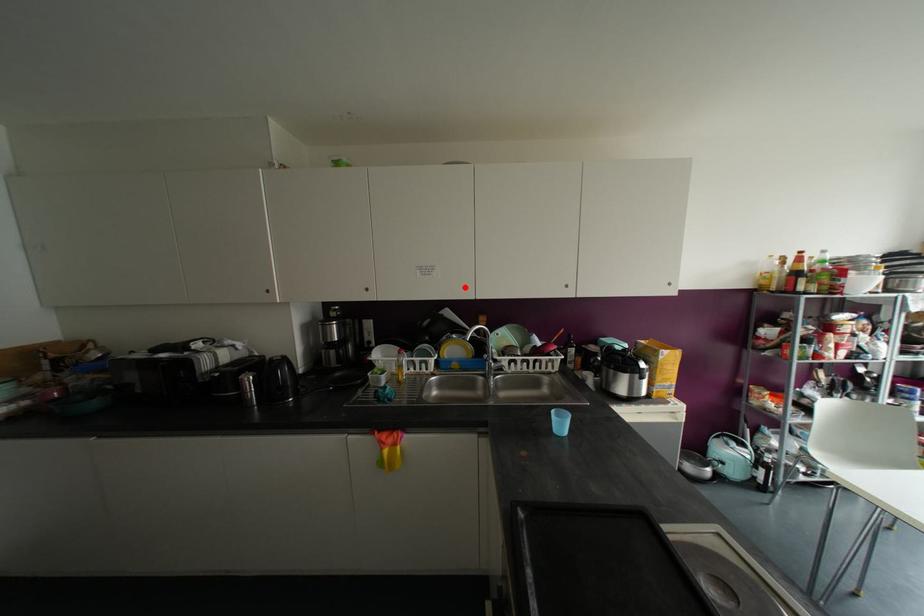
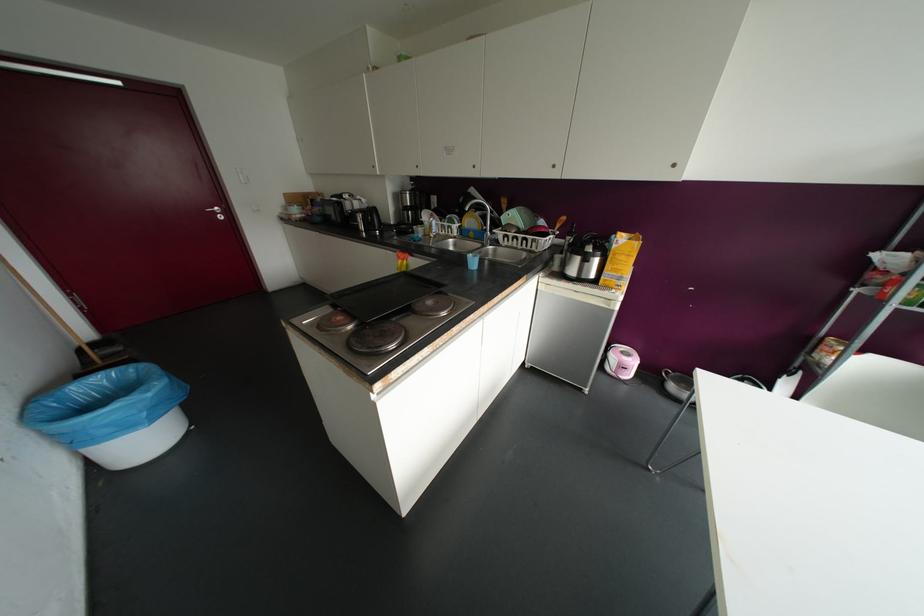
Locate, in the second image, the point that corresponds to the highlighted location in the first image.

(473, 166)